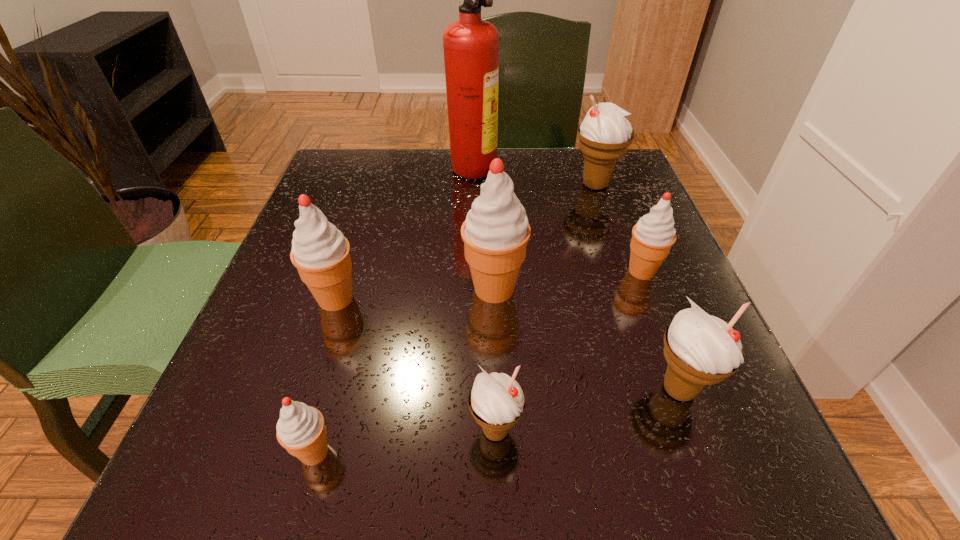
Locate an element on the screen. The width and height of the screenshot is (960, 540). icecream that is positioned at the far edge is located at coordinates (605, 134).

This screenshot has height=540, width=960. I want to click on object present at the near left corner, so click(x=301, y=430).

At what (x,y) coordinates should I click in order to perform the action: click on object located in the far right corner section of the desktop. Please return your answer as a coordinate pair (x, y). This screenshot has width=960, height=540. Looking at the image, I should click on (605, 134).

Where is `free region at the far edge`? The height and width of the screenshot is (540, 960). free region at the far edge is located at coordinates (502, 152).

Where is `vacant space at the near edge of the desktop`? The height and width of the screenshot is (540, 960). vacant space at the near edge of the desktop is located at coordinates (378, 444).

You are a GUI agent. You are given a task and a screenshot of the screen. Output one action in this format:
    pyautogui.click(x=<x>, y=<y>)
    Task: Click on the blank space at the left edge of the desktop
    
    Given the screenshot: What is the action you would take?
    pyautogui.click(x=347, y=347)

The width and height of the screenshot is (960, 540). Find the location of `free space at the right edge of the desktop`. free space at the right edge of the desktop is located at coordinates (621, 252).

At what (x,y) coordinates should I click in order to perform the action: click on vacant space at the far left corner. Please return your answer as a coordinate pair (x, y). The height and width of the screenshot is (540, 960). Looking at the image, I should click on (336, 171).

In the image, there is a desktop. At what (x,y) coordinates should I click in order to perform the action: click on vacant region at the far right corner. Please return your answer as a coordinate pair (x, y). The image size is (960, 540). Looking at the image, I should click on (618, 181).

This screenshot has height=540, width=960. Identify the location of blank space at the near right corner. (x=680, y=489).